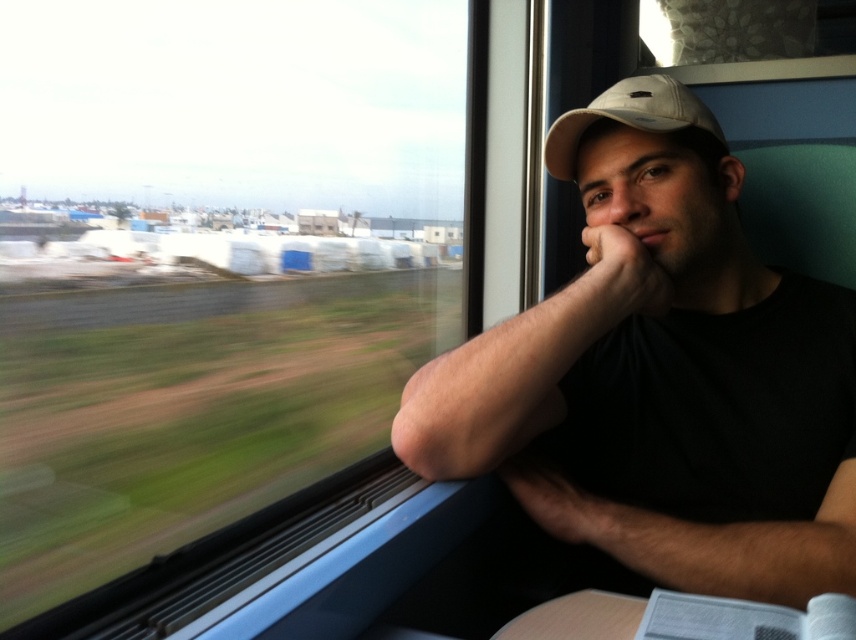
You are a passenger on the train and want to check the view outside through the transparent glass train window at upper left while keeping your white matte baseball cap at upper right visible in the reflection. Is the window wide enough to see both the outside view and the cap in the reflection?

The transparent glass train window at upper left is wider than the white matte baseball cap at upper right, so yes, the window is wide enough to allow the passenger to see both the outside view and the cap in the reflection.

In the scene shown: You are a passenger on the train and want to see the outside view clearly. You have the transparent glass train window at upper left and the beige fabric cap at upper right in your line of sight. Which object should you look through to get a better view of the outside?

The transparent glass train window at upper left is much taller than the beige fabric cap at upper right, so you should look through the transparent glass train window at upper left to get a better view of the outside.